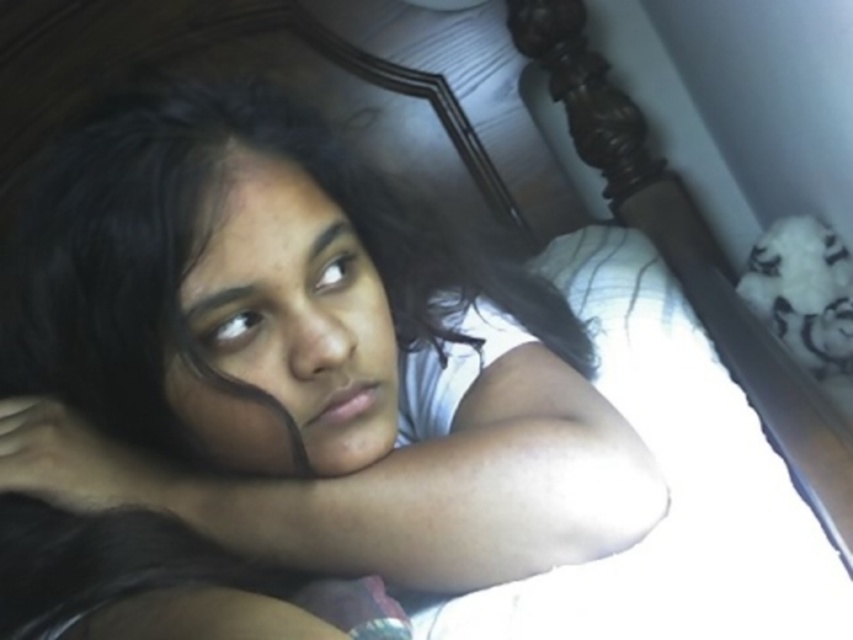
Looking at this image, which is more to the left, smooth skin girl at center or smooth skin face at center?

Positioned to the left is smooth skin face at center.

Can you confirm if smooth skin girl at center is positioned below smooth skin face at center?

No.

Is point (171, 512) positioned in front of point (276, 228)?

No.

Find the location of a particular element. The width and height of the screenshot is (853, 640). smooth skin girl at center is located at coordinates (283, 387).